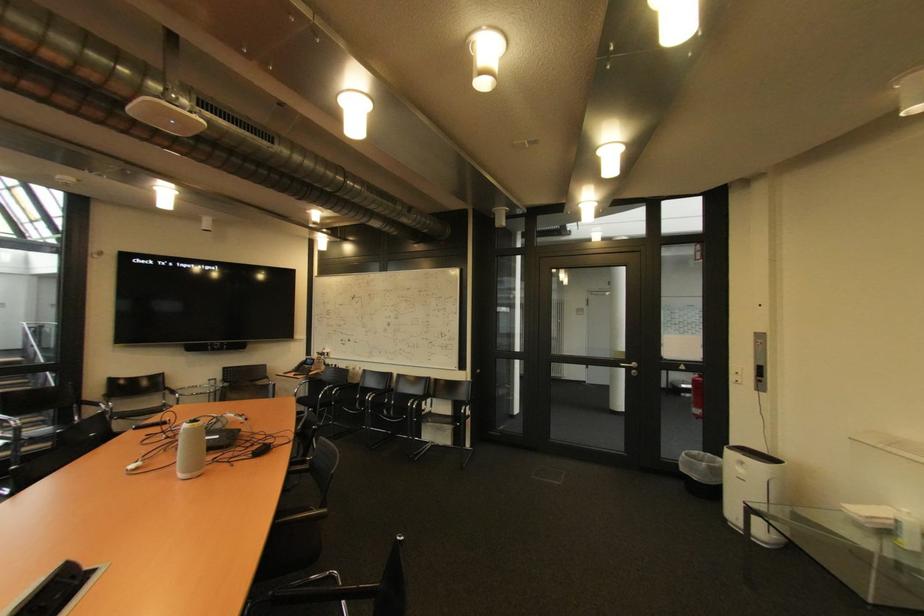
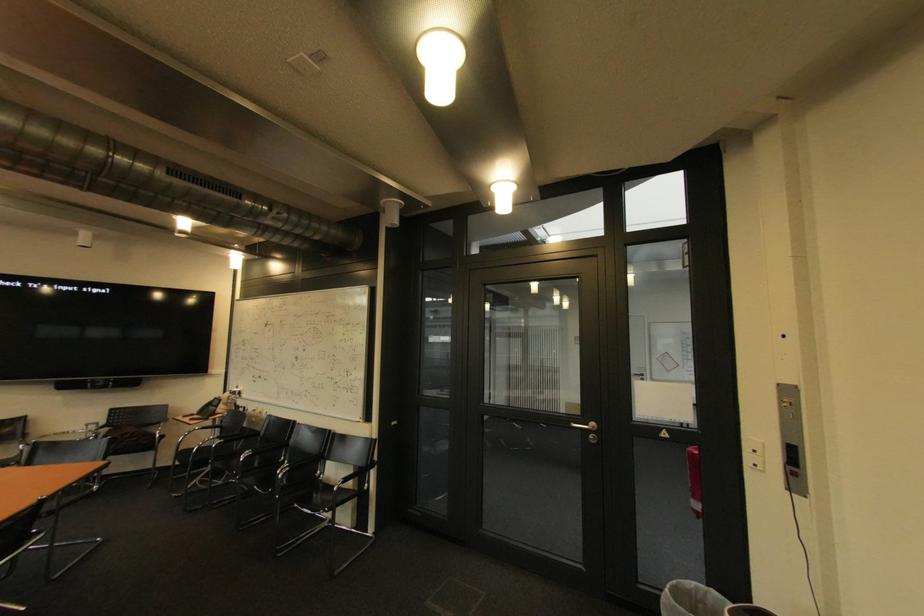
Locate, in the second image, the point that corresponds to (302,373) in the first image.

(204, 416)